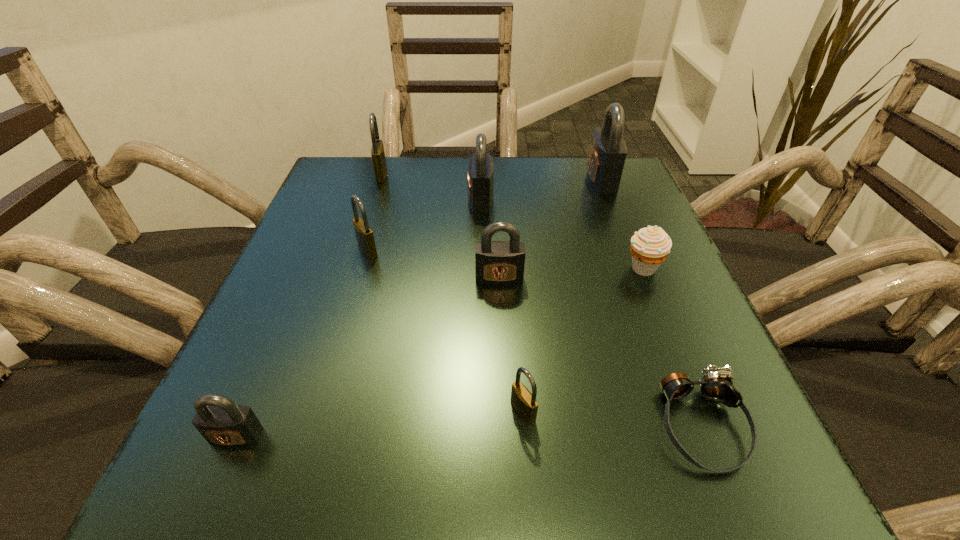
I want to click on vacant region at the near left corner of the desktop, so click(x=228, y=454).

Image resolution: width=960 pixels, height=540 pixels. I want to click on vacant area that lies between the bronze goggles and the tallest padlock, so click(x=651, y=302).

Locate an element on the screen. The height and width of the screenshot is (540, 960). free area in between the biggest brass padlock and the third smallest gray padlock is located at coordinates [x=431, y=187].

I want to click on free spot between the nearest gray padlock and the muffin, so click(x=440, y=352).

Where is `vacant space in between the muffin and the shortest object`? The height and width of the screenshot is (540, 960). vacant space in between the muffin and the shortest object is located at coordinates (672, 347).

Identify the location of free point between the muffin and the leftmost gray padlock. pyautogui.click(x=440, y=352).

Locate an element on the screen. The image size is (960, 540). free space between the second farthest brass padlock and the nearest brass padlock is located at coordinates [445, 331].

At what (x,y) coordinates should I click in order to perform the action: click on object that stands as the closest to the bronze goggles. Please return your answer as a coordinate pair (x, y). The height and width of the screenshot is (540, 960). Looking at the image, I should click on (524, 403).

You are a GUI agent. You are given a task and a screenshot of the screen. Output one action in this format:
    pyautogui.click(x=<x>, y=<y>)
    Task: Click on the third closest object relative to the third smallest gray padlock
    The image size is (960, 540).
    Given the screenshot: What is the action you would take?
    pyautogui.click(x=377, y=150)

Find the location of a particular element. The image size is (960, 540). padlock identified as the second closest to the third smallest gray padlock is located at coordinates (364, 234).